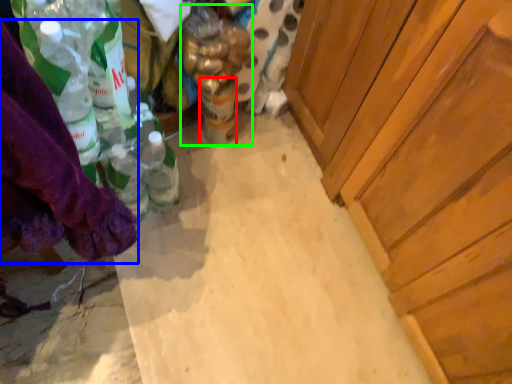
Question: Considering the real-world distances, which object is closest to beverage (highlighted by a red box)? clothing (highlighted by a blue box) or bottle (highlighted by a green box).

Choices:
 (A) clothing
 (B) bottle

Answer: (B)